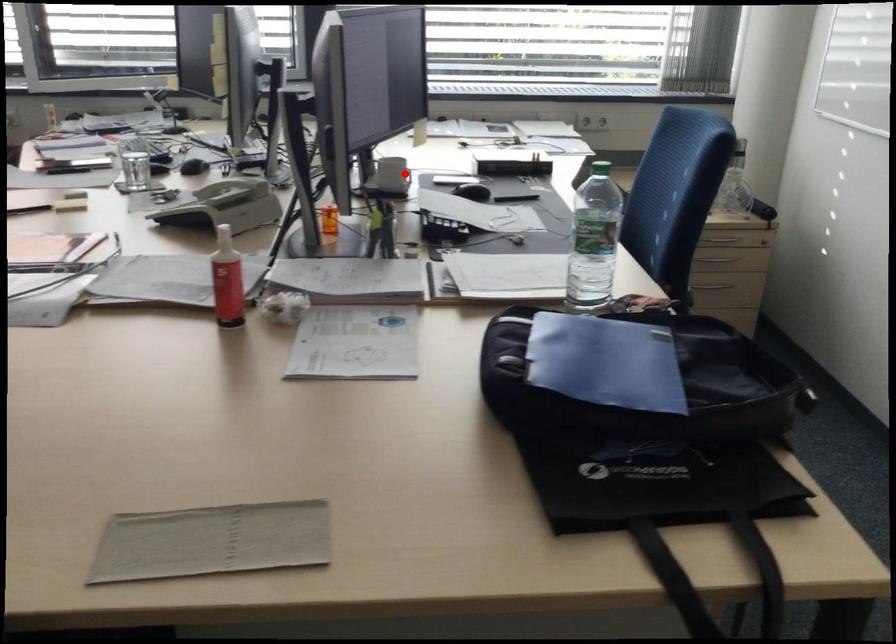
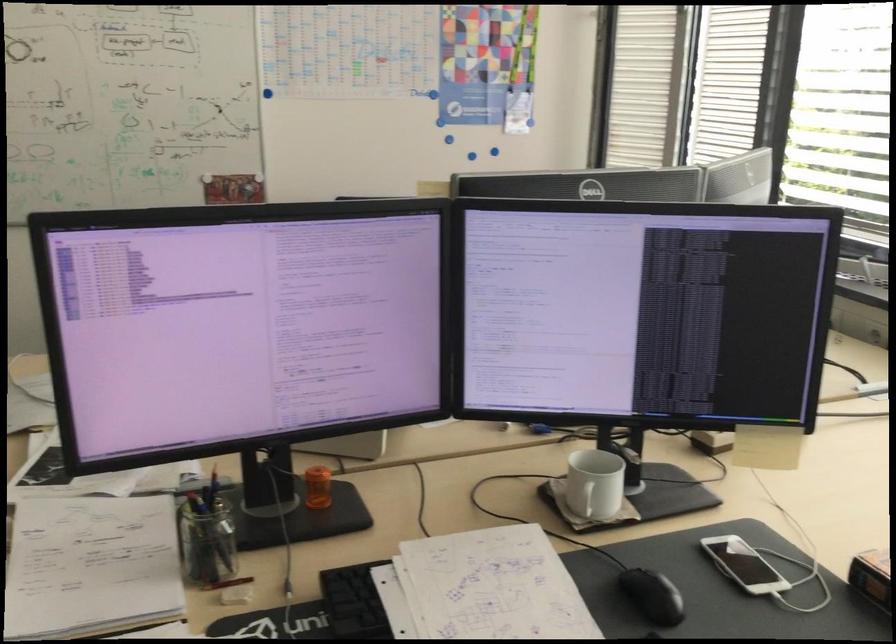
Question: I am providing you with two images of the same scene from different viewpoints. Image1 has a red point marked. In image2, the corresponding 3D location appears at what relative position? Reply with the corresponding letter.

Choices:
 (A) Closer
 (B) Farther

Answer: (A)